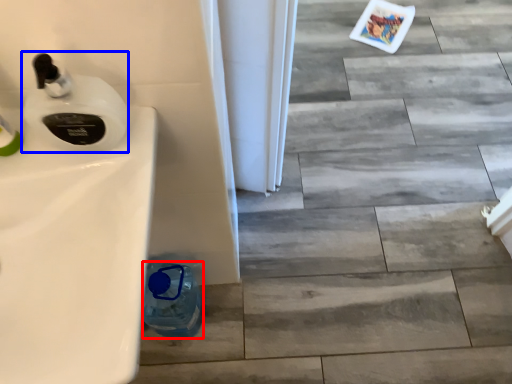
Question: Which object appears farthest to the camera in this image, bottle (highlighted by a red box) or soap dispenser (highlighted by a blue box)?

Choices:
 (A) bottle
 (B) soap dispenser

Answer: (A)